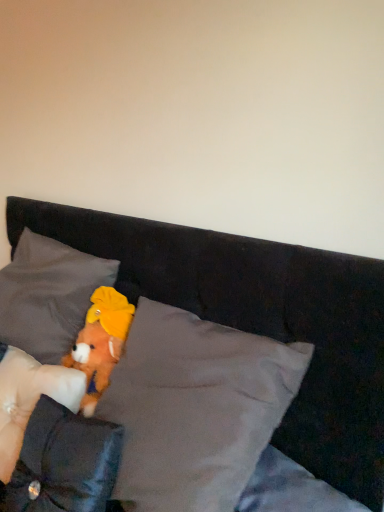
Question: Is velvet gray pillow at lower left, the 1th pillow when ordered from front to back, inside or outside of dark gray plush pillow at left, which is the first pillow from back to front?

Choices:
 (A) inside
 (B) outside

Answer: (B)

Question: Is velvet gray pillow at lower left, the 1th pillow when ordered from front to back, taller or shorter than dark gray plush pillow at left, the 3th pillow in the front-to-back sequence?

Choices:
 (A) tall
 (B) short

Answer: (A)

Question: Based on their relative distances, which object is farther from the soft white pillow at lower left, the 2th pillow viewed from the front?

Choices:
 (A) velvet gray pillow at lower left, the 1th pillow when ordered from front to back
 (B) fluffy orange teddy bear at center
 (C) dark gray plush pillow at left, the 3th pillow in the front-to-back sequence
 (D) fluffy fabric stuffed animal at center

Answer: (D)

Question: Which object is positioned farthest from the velvet gray pillow at lower left, the 1th pillow when ordered from front to back?

Choices:
 (A) dark gray plush pillow at left, which is the first pillow from back to front
 (B) fluffy fabric stuffed animal at center
 (C) fluffy orange teddy bear at center
 (D) soft white pillow at lower left, the 2th pillow viewed from the front

Answer: (B)